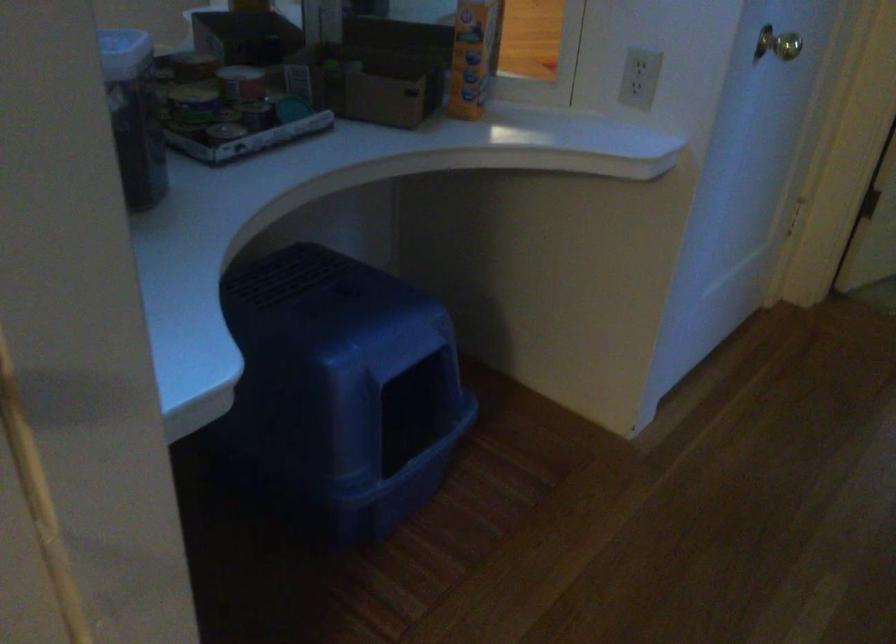
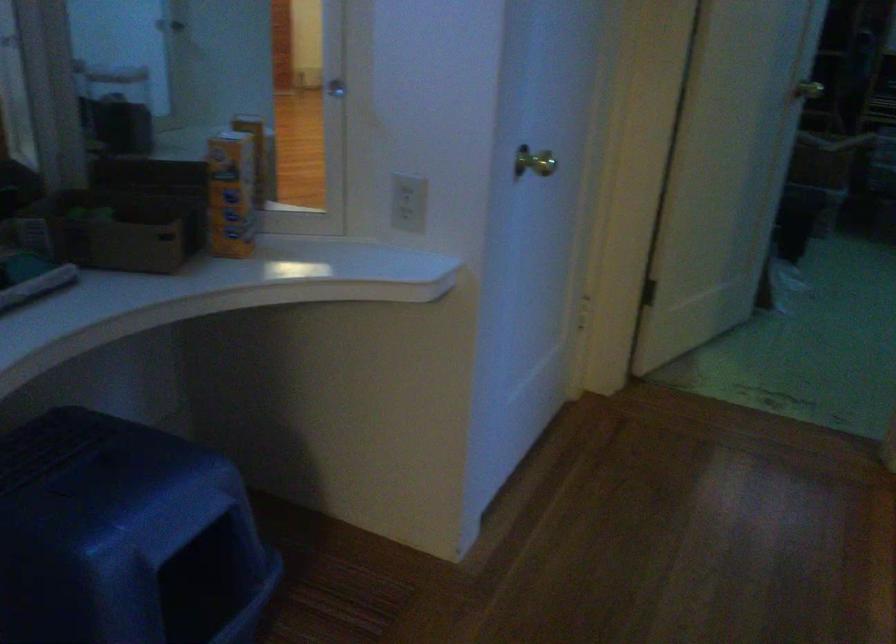
Which direction would the cameraman need to move to produce the second image?

The cameraman walked toward right, forward.